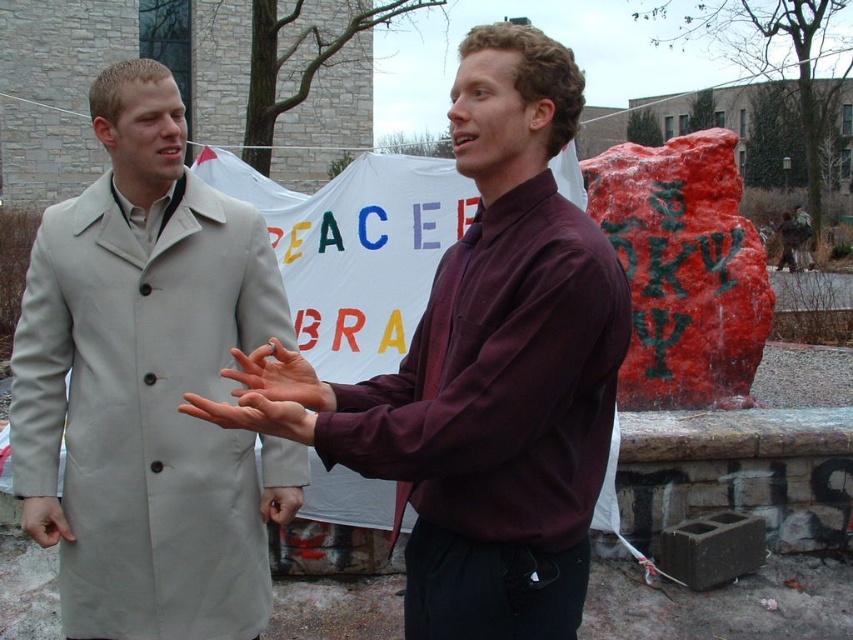
Question: Does light beige trench coat at left appear on the right side of smooth skin hand at center?

Choices:
 (A) yes
 (B) no

Answer: (B)

Question: Which of these objects is positioned closest to the maroon shirt at center?

Choices:
 (A) smooth skin hand at center
 (B) light beige trench coat at left
 (C) matte skin hand at center

Answer: (A)

Question: Considering the real-world distances, which object is farthest from the maroon shirt at center?

Choices:
 (A) smooth skin hand at center
 (B) light beige trench coat at left

Answer: (B)

Question: Is light beige trench coat at left behind smooth skin hand at center?

Choices:
 (A) no
 (B) yes

Answer: (B)

Question: Among these objects, which one is farthest from the camera?

Choices:
 (A) matte skin hand at center
 (B) smooth skin hand at center
 (C) light beige trench coat at left

Answer: (C)

Question: Does maroon shirt at center appear on the right side of smooth skin hand at center?

Choices:
 (A) yes
 (B) no

Answer: (A)